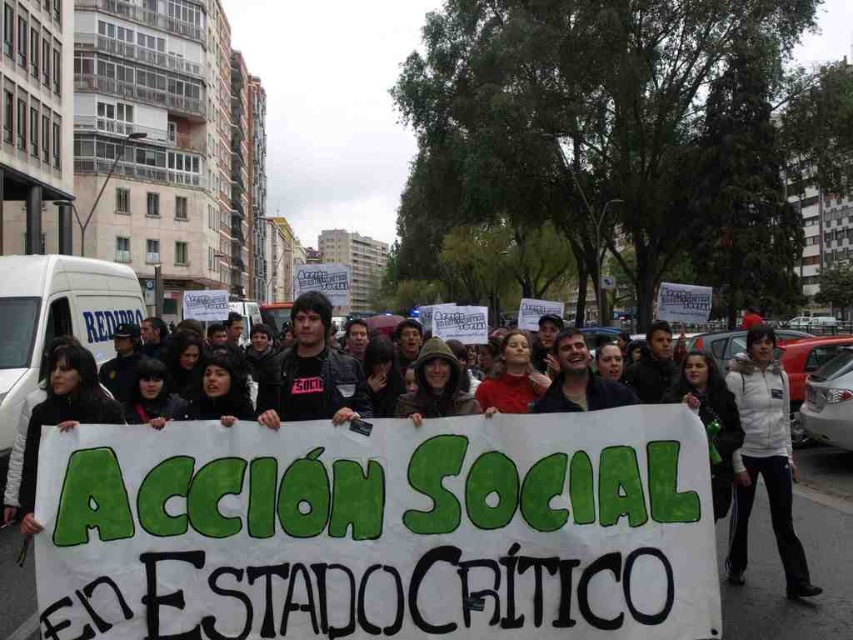
Between white fleece jacket at lower right and black matte shirt at center, which one is positioned lower?

white fleece jacket at lower right

Does white fleece jacket at lower right have a lesser height compared to black matte shirt at center?

In fact, white fleece jacket at lower right may be taller than black matte shirt at center.

Is point (762, 436) farther from camera compared to point (292, 403)?

That is True.

At what (x,y) coordinates should I click in order to perform the action: click on white fleece jacket at lower right. Please return your answer as a coordinate pair (x, y). Looking at the image, I should click on (763, 460).